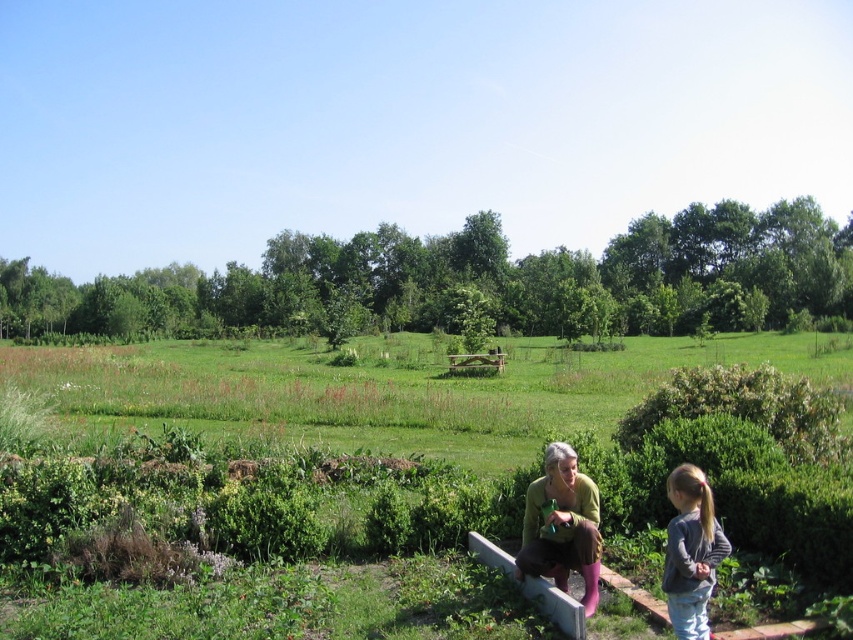
You are a photographer trying to capture a closeup of the green grass at lower center. However, the green knitted sweater at lower center is blocking your view. Can you move the sweater to get a clear shot?

The green grass at lower center is positioned under the green knitted sweater at lower center, so moving the sweater would allow you to see the grass clearly.

You are standing at the point with coordinates point (788, 365) and want to walk towards the point (595, 496). Since you can only move forward, will you be moving away from or towards the viewer?

Since point (788, 365) is further to the viewer than point (595, 496), moving forward from point (788, 365) towards point (595, 496) would mean you are moving away from the viewer.